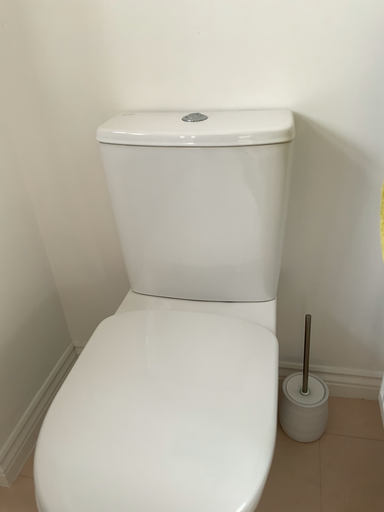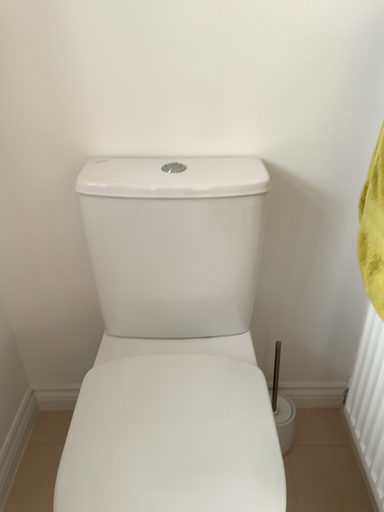
Question: Which way did the camera rotate in the video?

Choices:
 (A) rotated left
 (B) rotated right

Answer: (B)